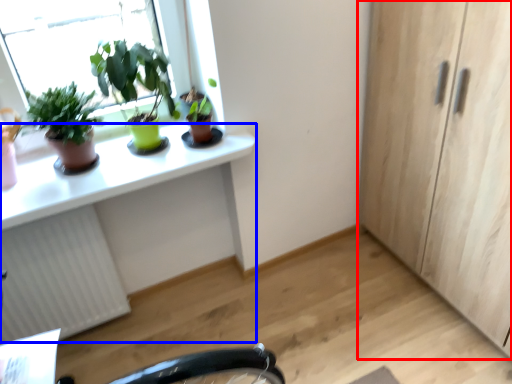
Question: Which object appears closest to the camera in this image, cabinetry (highlighted by a red box) or computer desk (highlighted by a blue box)?

Choices:
 (A) cabinetry
 (B) computer desk

Answer: (B)